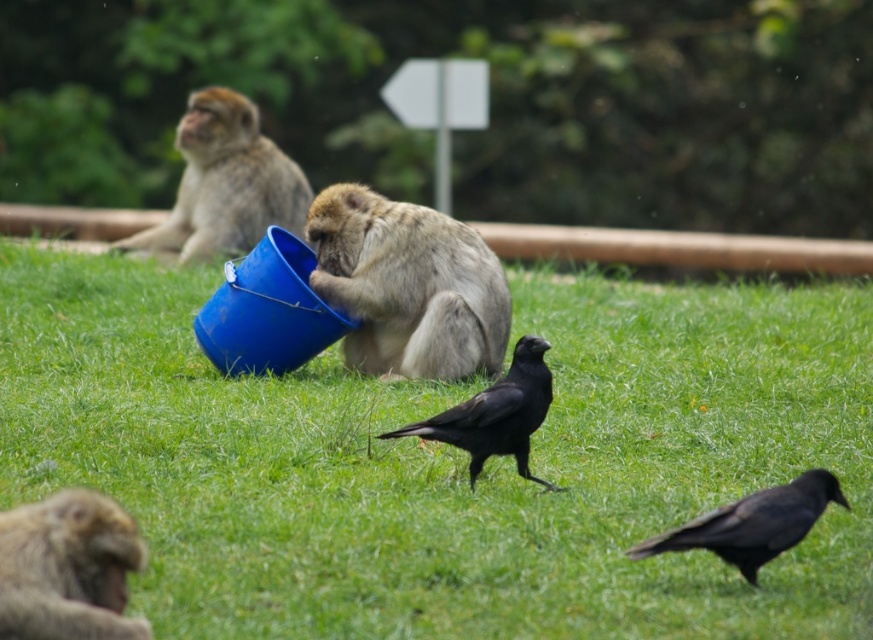
Is brown furry monkey at lower left smaller than black matte bird at center?

Indeed, brown furry monkey at lower left has a smaller size compared to black matte bird at center.

Between brown furry monkey at lower left and black matte bird at center, which one has less height?

With less height is brown furry monkey at lower left.

The image size is (873, 640). What do you see at coordinates (67, 568) in the screenshot?
I see `brown furry monkey at lower left` at bounding box center [67, 568].

At what (x,y) coordinates should I click in order to perform the action: click on brown furry monkey at lower left. Please return your answer as a coordinate pair (x, y). Looking at the image, I should click on (67, 568).

Is brown furry monkey at lower left further to the viewer compared to black glossy crow at lower right?

No, brown furry monkey at lower left is closer to the viewer.

Who is more forward, (21, 600) or (760, 513)?

Point (21, 600) is in front.

Who is more forward, (52, 536) or (691, 524)?

Point (52, 536) is in front.

The width and height of the screenshot is (873, 640). Identify the location of brown furry monkey at lower left. (67, 568).

Who is more distant from viewer, (352, 333) or (107, 502)?

Positioned behind is point (352, 333).

Is point (423, 298) in front of point (33, 518)?

No.

Find the location of `furry beige monkey at center`. furry beige monkey at center is located at coordinates (408, 285).